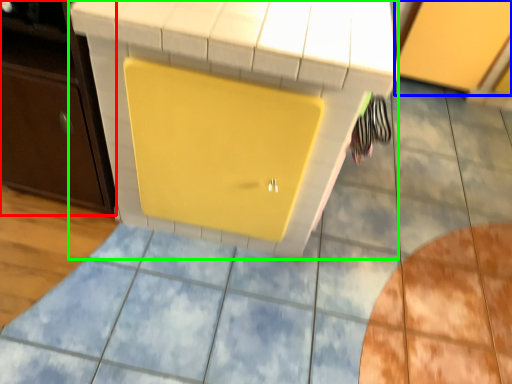
Question: Estimate the real-world distances between objects in this image. Which object is closer to cabinetry (highlighted by a red box), cabinetry (highlighted by a blue box) or vanity (highlighted by a green box)?

Choices:
 (A) cabinetry
 (B) vanity

Answer: (B)